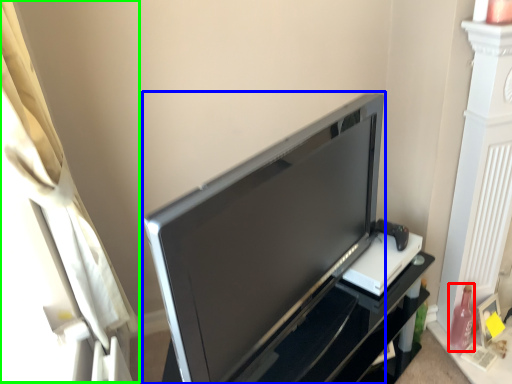
Question: Which object is positioned farthest from bottle (highlighted by a red box)? Select from television (highlighted by a blue box) and curtain (highlighted by a green box).

Choices:
 (A) television
 (B) curtain

Answer: (B)